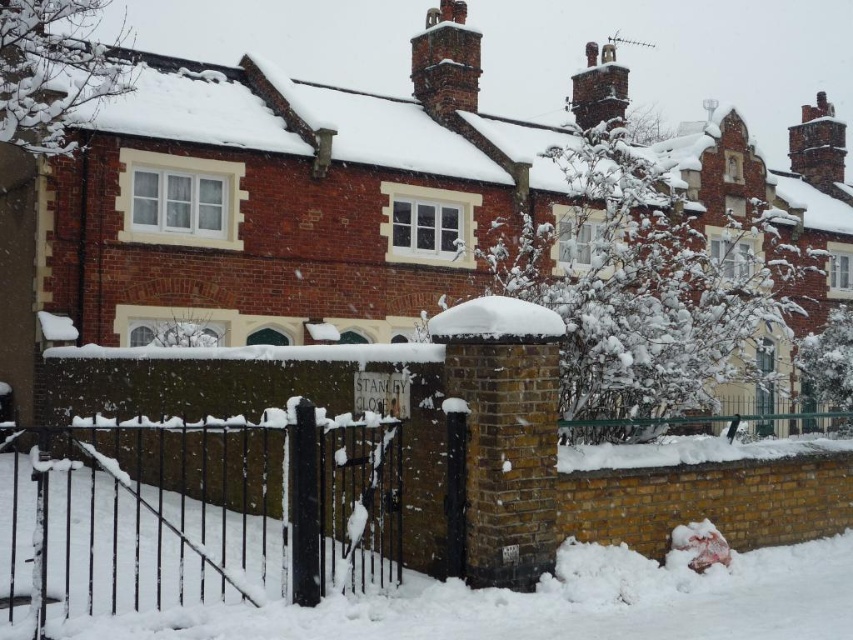
Question: Which point is closer to the camera?

Choices:
 (A) (822, 573)
 (B) (166, 444)
 (C) (328, 548)
 (D) (448, 316)

Answer: (D)

Question: Which point is closer to the camera?

Choices:
 (A) (186, 609)
 (B) (521, 333)

Answer: (A)

Question: Is black wrought iron gate at center to the right of white fluffy snow at center from the viewer's perspective?

Choices:
 (A) yes
 (B) no

Answer: (B)

Question: Is black wrought iron gate at lower center closer to camera compared to white fluffy snow at center?

Choices:
 (A) yes
 (B) no

Answer: (A)

Question: Does white fluffy snow at lower left have a lesser width compared to white fluffy snow at center?

Choices:
 (A) no
 (B) yes

Answer: (A)

Question: Estimate the real-world distances between objects in this image. Which object is closer to the black wrought iron gate at center?

Choices:
 (A) white fluffy snow at center
 (B) black wrought iron gate at lower center

Answer: (B)